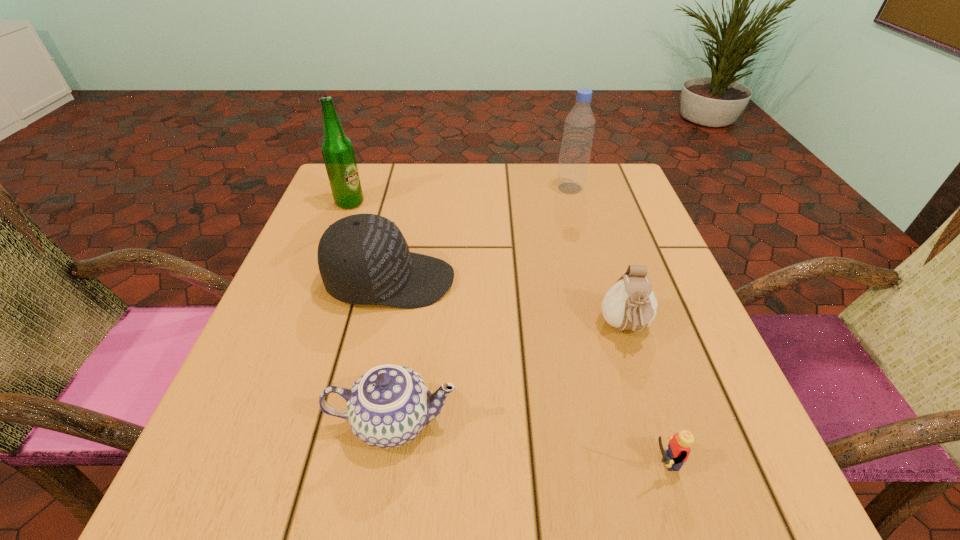
Locate an element on the screen. This screenshot has width=960, height=540. bottle at the right edge is located at coordinates (579, 126).

Where is `pouch at the right edge`? pouch at the right edge is located at coordinates (630, 304).

At what (x,y) coordinates should I click in order to perform the action: click on Lego present at the right edge. Please return your answer as a coordinate pair (x, y). The height and width of the screenshot is (540, 960). Looking at the image, I should click on (678, 451).

What are the coordinates of `object present at the far left corner` in the screenshot? It's located at (337, 149).

Locate an element on the screen. This screenshot has height=540, width=960. object at the far right corner is located at coordinates (579, 126).

In order to click on object present at the near right corner in this screenshot , I will do `click(678, 451)`.

Where is `blank space at the far edge of the desktop`? The height and width of the screenshot is (540, 960). blank space at the far edge of the desktop is located at coordinates (489, 179).

Find the location of a particular element. free space at the near edge of the desktop is located at coordinates (632, 478).

In the image, there is a desktop. What are the coordinates of `vacant space at the left edge` in the screenshot? It's located at (308, 288).

The height and width of the screenshot is (540, 960). Identify the location of blank space at the right edge of the desktop. (693, 353).